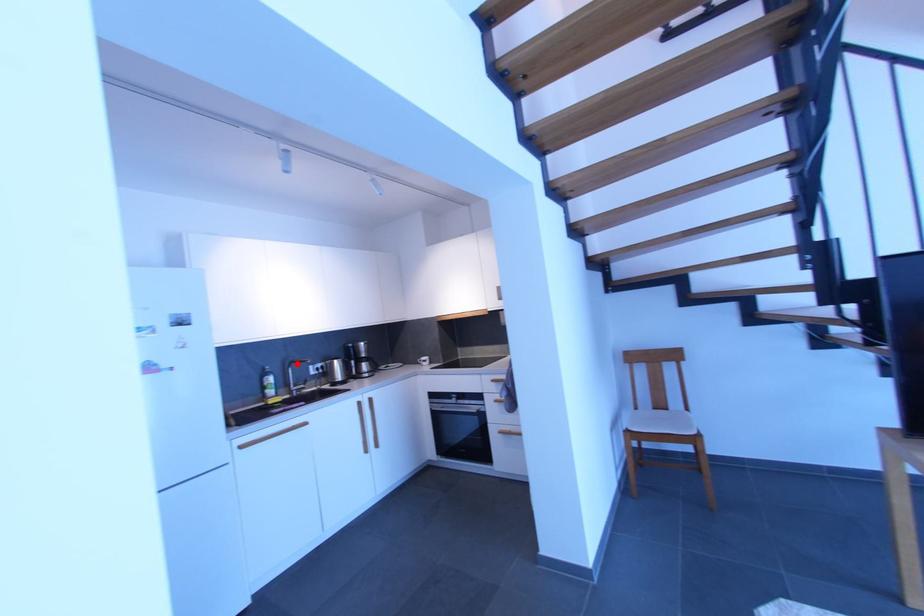
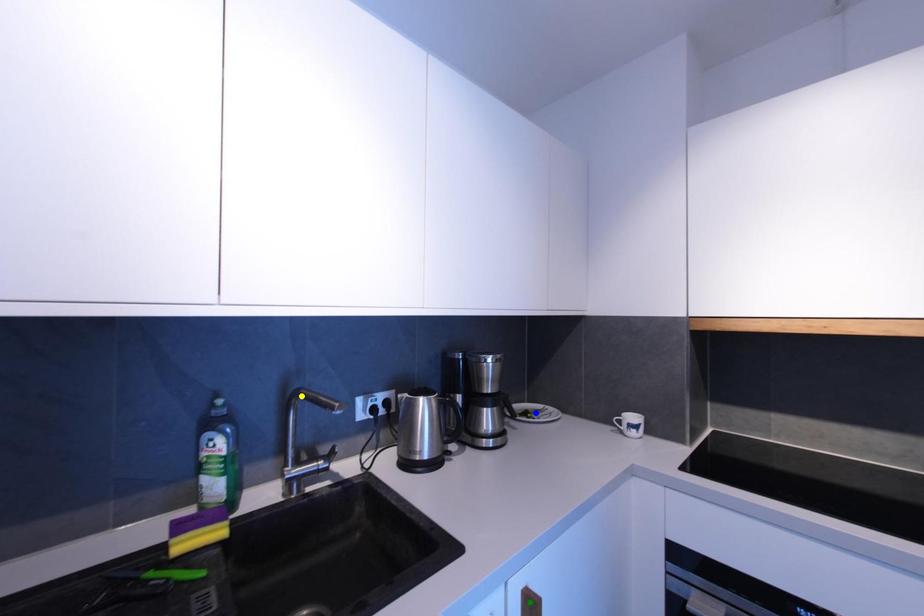
Question: I am providing you with two images of the same scene from different viewpoints. A red point is marked on the first image. You are given multiple points on the second image. Which point in image 2 is actually the same real-world point as the red point in image 1?

Choices:
 (A) blue point
 (B) green point
 (C) yellow point

Answer: (C)